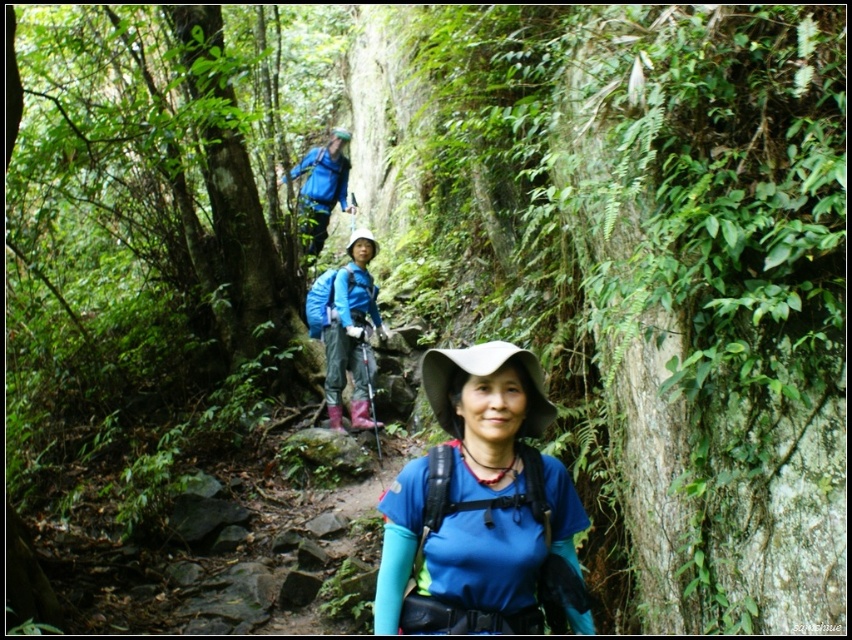
Where is `green rough bark tree at left`? The height and width of the screenshot is (640, 852). green rough bark tree at left is located at coordinates (160, 170).

Who is more forward, (50, 216) or (403, 612)?

Point (403, 612) is more forward.

Describe the element at coordinates (160, 170) in the screenshot. I see `green rough bark tree at left` at that location.

In order to click on green rough bark tree at left in this screenshot , I will do `click(160, 170)`.

Is green rough bark tree at left to the right of blue fabric jacket at upper center from the viewer's perspective?

Incorrect, green rough bark tree at left is not on the right side of blue fabric jacket at upper center.

Is green rough bark tree at left below blue fabric jacket at upper center?

Indeed, green rough bark tree at left is positioned under blue fabric jacket at upper center.

Locate an element on the screen. green rough bark tree at left is located at coordinates (160, 170).

This screenshot has width=852, height=640. Find the location of `green rough bark tree at left`. green rough bark tree at left is located at coordinates (160, 170).

Does blue fabric shirt at center appear under blue fabric jacket at center?

Yes, blue fabric shirt at center is below blue fabric jacket at center.

Is blue fabric shirt at center wider than blue fabric jacket at center?

Incorrect, blue fabric shirt at center's width does not surpass blue fabric jacket at center's.

Who is more forward, (x=441, y=621) or (x=330, y=401)?

Point (x=441, y=621)

At what (x,y) coordinates should I click in order to perform the action: click on blue fabric shirt at center. Please return your answer as a coordinate pair (x, y). The height and width of the screenshot is (640, 852). Looking at the image, I should click on (481, 508).